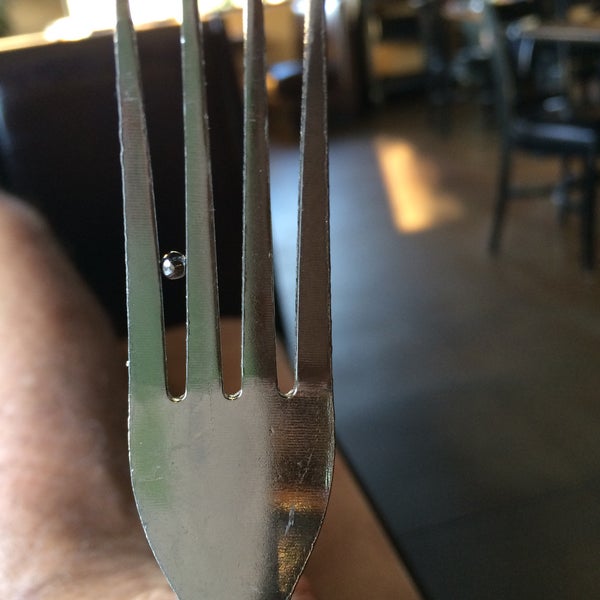
At what (x,y) coordinates should I click in order to perform the action: click on front right chair leg. Please return your answer as a coordinate pair (x, y). The image size is (600, 600). Looking at the image, I should click on (584, 207).